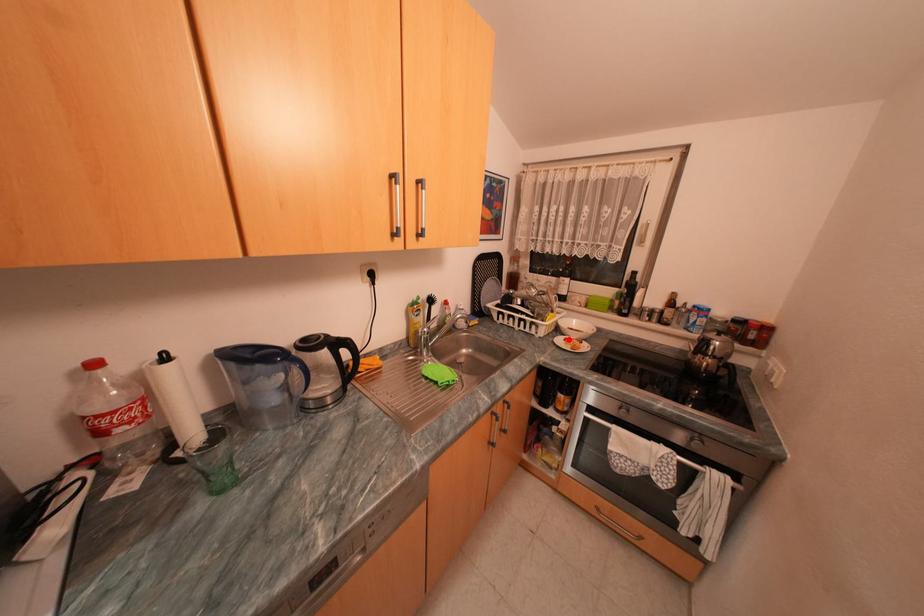
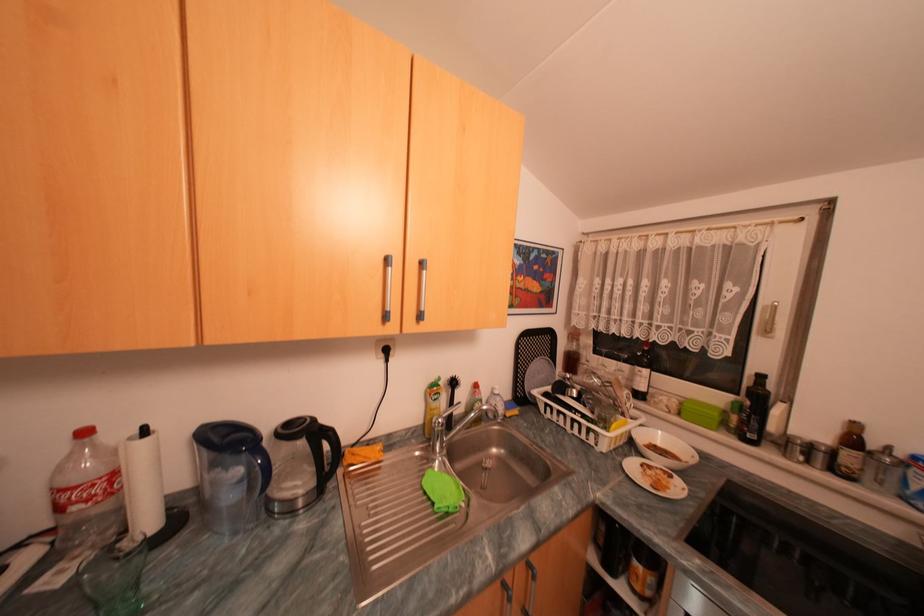
Locate, in the second image, the point that corresponds to the highlighted location in the first image.

(641, 464)